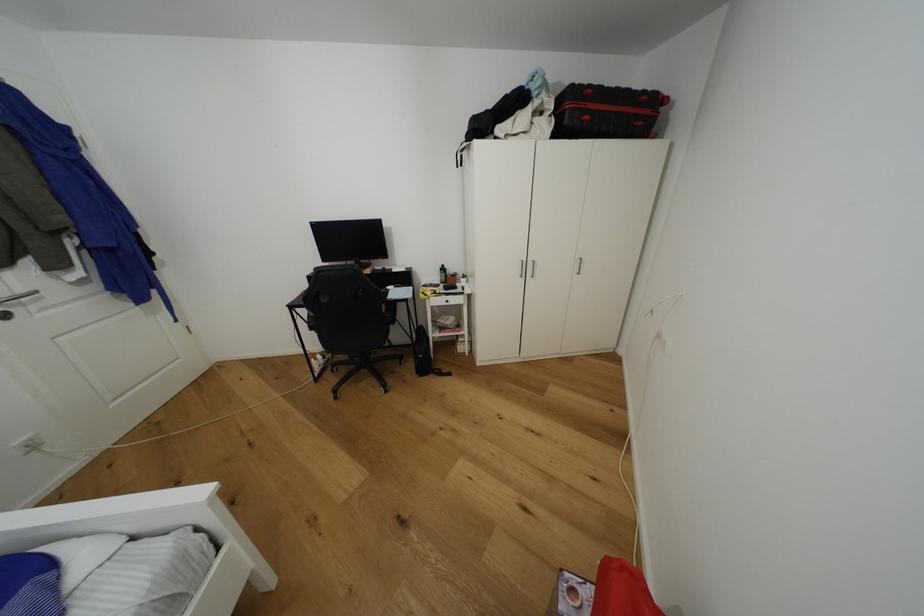
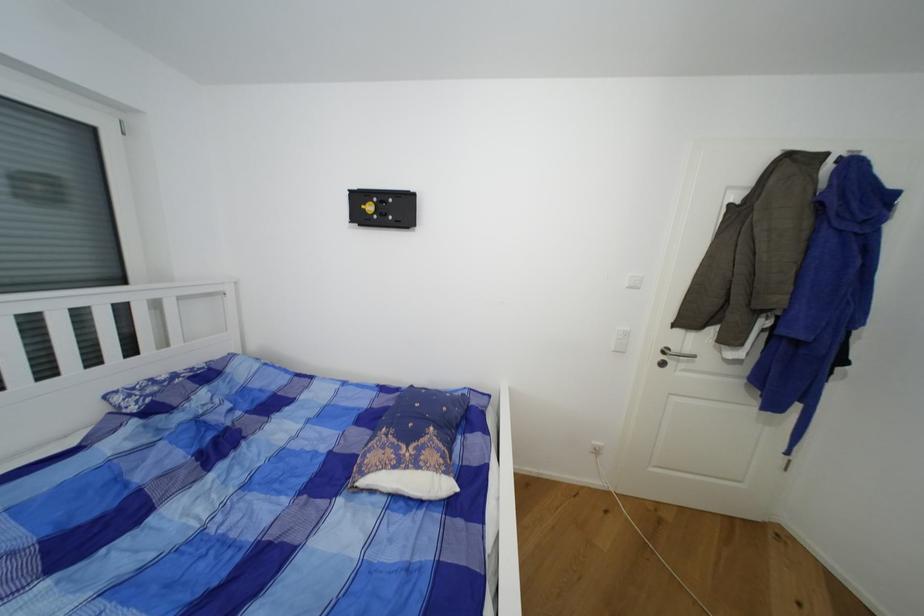
Find the pixel in the second image that matches [27,293] in the first image.

(691, 352)